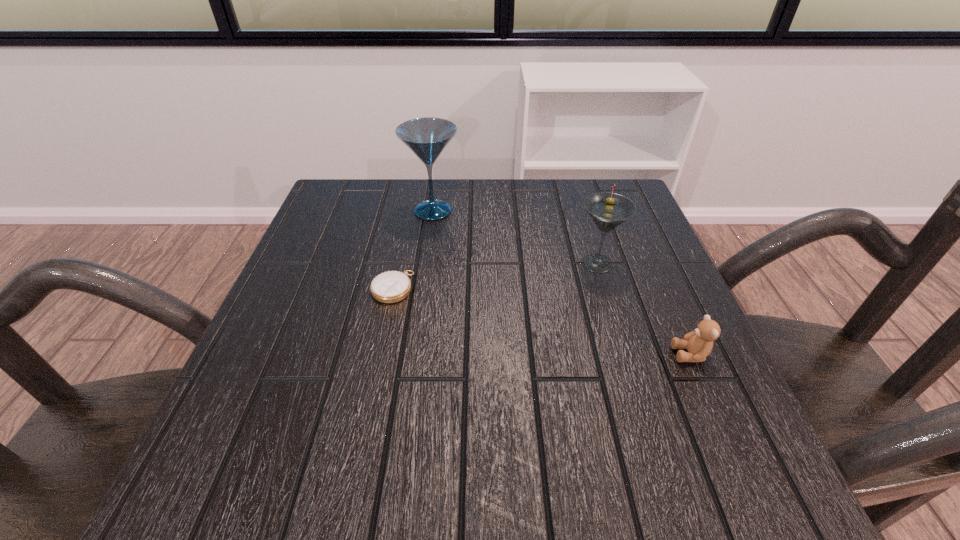
Locate an element on the screen. The width and height of the screenshot is (960, 540). free spot located 0.380m on the front-facing side of the nearest object is located at coordinates (453, 354).

This screenshot has width=960, height=540. In order to click on vacant area situated 0.060m on the front-facing side of the nearest object in this screenshot , I will do [638, 354].

I want to click on vacant position located on the right of the shortest object, so click(x=562, y=287).

Identify the location of object located in the far edge section of the desktop. (427, 137).

The image size is (960, 540). I want to click on martini that is at the right edge, so click(608, 210).

Where is `teddy bear located in the right edge section of the desktop`? The image size is (960, 540). teddy bear located in the right edge section of the desktop is located at coordinates (699, 343).

Identify the location of free location at the far edge of the desktop. (392, 195).

In order to click on vacant point at the near edge in this screenshot , I will do `click(413, 502)`.

The height and width of the screenshot is (540, 960). I want to click on free space at the left edge, so click(325, 241).

Find the location of a particular element. Image resolution: width=960 pixels, height=540 pixels. vacant space at the right edge of the desktop is located at coordinates (655, 247).